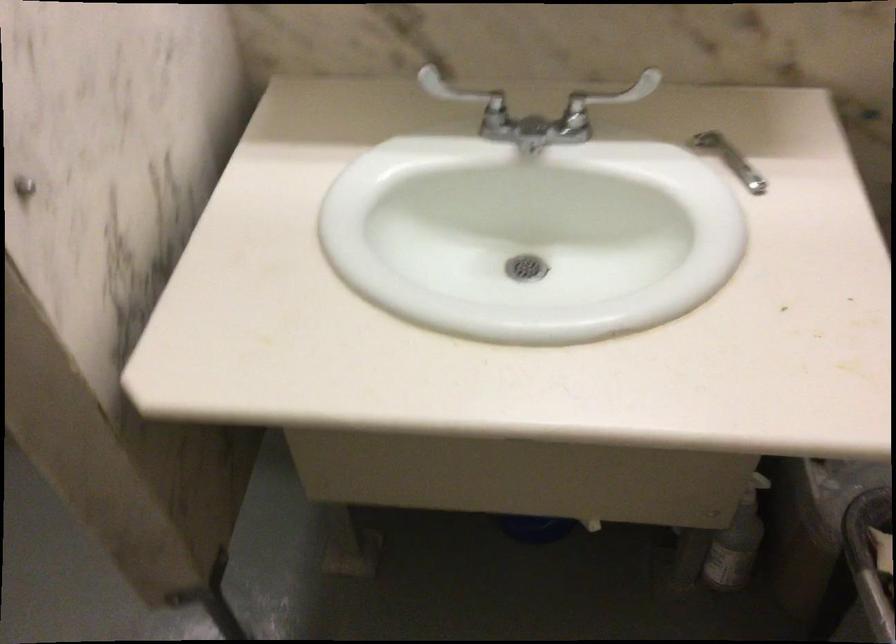
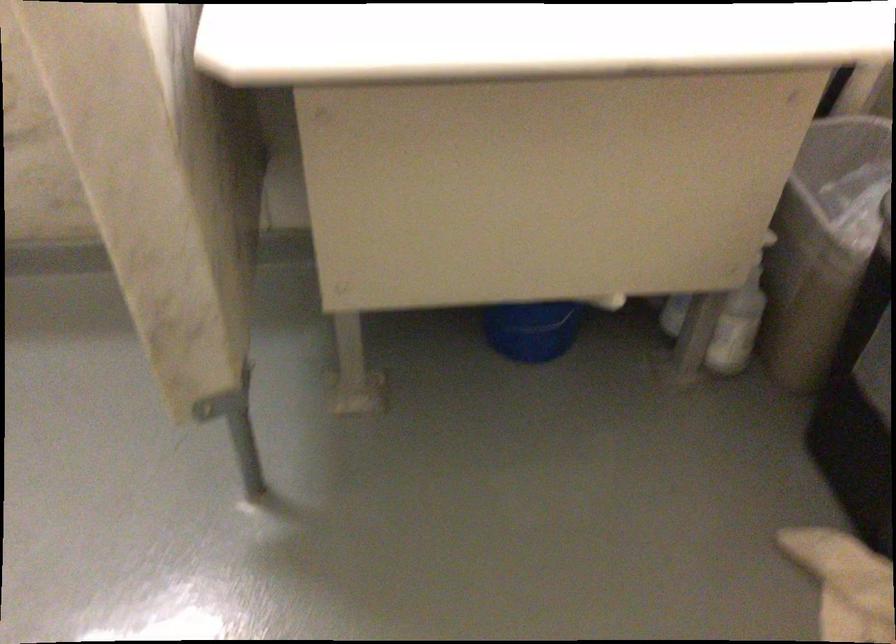
Question: The camera is either moving clockwise (left) or counter-clockwise (right) around the object. The first image is from the beginning of the video and the second image is from the end. Is the camera moving left or right when shooting the video?

Choices:
 (A) Left
 (B) Right

Answer: (A)